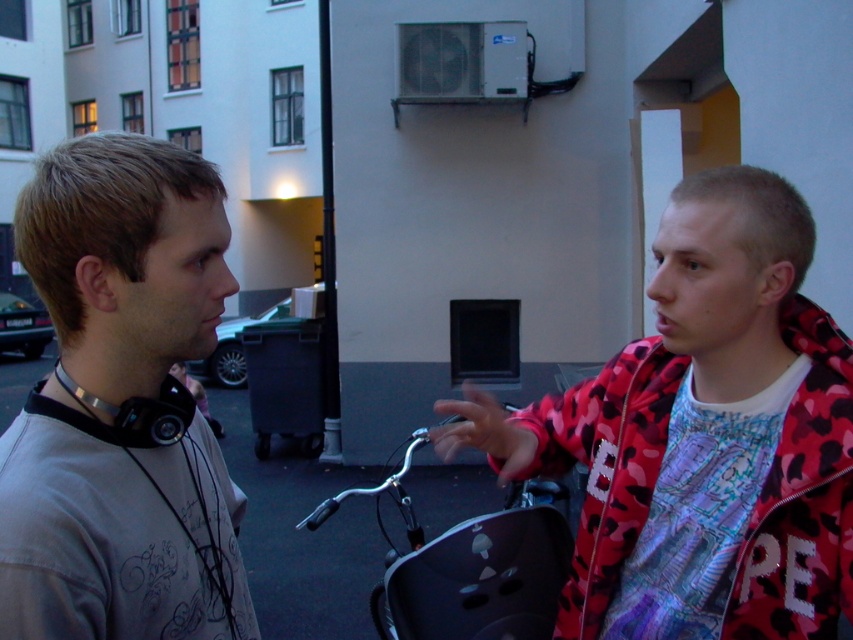
Question: Which point is farther to the camera?

Choices:
 (A) (779, 582)
 (B) (129, 221)

Answer: (A)

Question: Which of the following is the farthest from the observer?

Choices:
 (A) gray matte shirt at left
 (B) camouflage-patterned jacket at right

Answer: (B)

Question: Is gray matte shirt at left below camouflage-patterned jacket at right?

Choices:
 (A) no
 (B) yes

Answer: (A)

Question: Can you confirm if gray matte shirt at left is thinner than camouflage-patterned jacket at right?

Choices:
 (A) yes
 (B) no

Answer: (A)

Question: From the image, what is the correct spatial relationship of gray matte shirt at left in relation to camouflage-patterned jacket at right?

Choices:
 (A) right
 (B) left

Answer: (B)

Question: Which point appears closest to the camera in this image?

Choices:
 (A) click(x=576, y=554)
 (B) click(x=67, y=369)

Answer: (B)